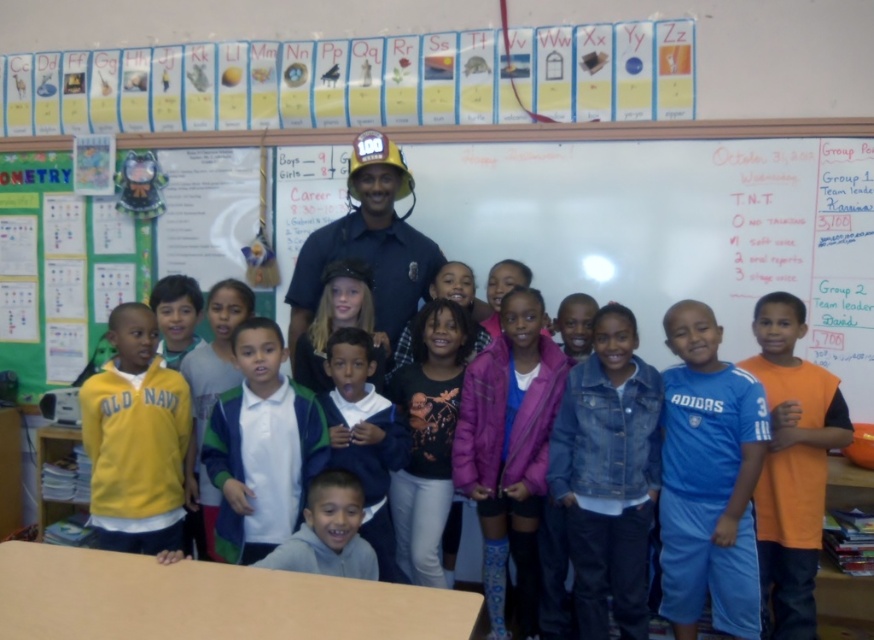
Consider the image. Who is lower down, whiteboard at upper center or orange jersey at right?

orange jersey at right is lower down.

Which is behind, point (708, 144) or point (786, 481)?

The point (708, 144) is behind.

Between point (418, 156) and point (771, 435), which one is positioned behind?

The point (418, 156) is more distant.

Find the location of `whiteboard at upper center`. whiteboard at upper center is located at coordinates coord(671,220).

Is the position of whiteboard at upper center more distant than that of blue adidas jersey at center?

That is True.

Who is shorter, whiteboard at upper center or blue adidas jersey at center?

blue adidas jersey at center is shorter.

Measure the distance between point (x=425, y=152) and camera.

A distance of 3.42 meters exists between point (x=425, y=152) and camera.

At what (x,y) coordinates should I click in order to perform the action: click on whiteboard at upper center. Please return your answer as a coordinate pair (x, y). This screenshot has height=640, width=874. Looking at the image, I should click on (671, 220).

Is yellow fleece jacket at left bigger than white cotton shirt at center?

Yes.

Is yellow fleece jacket at left below white cotton shirt at center?

No, yellow fleece jacket at left is not below white cotton shirt at center.

The image size is (874, 640). What are the coordinates of `yellow fleece jacket at left` in the screenshot? It's located at (135, 440).

This screenshot has width=874, height=640. I want to click on yellow fleece jacket at left, so click(135, 440).